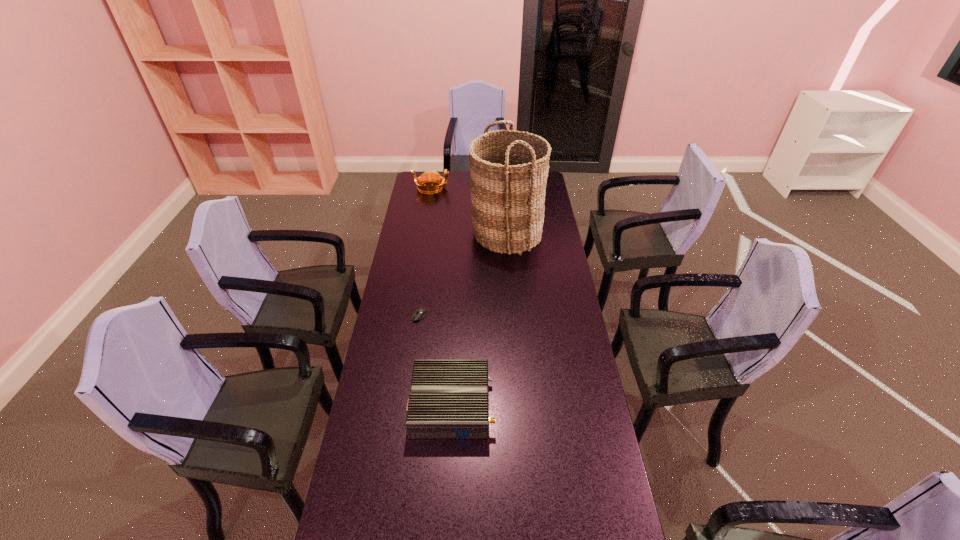
The height and width of the screenshot is (540, 960). Find the location of `basket`. basket is located at coordinates (509, 169).

This screenshot has width=960, height=540. In order to click on the tallest object in this screenshot , I will do `click(509, 169)`.

The height and width of the screenshot is (540, 960). What are the coordinates of `the farthest object` in the screenshot? It's located at (429, 176).

Where is `tiara`? tiara is located at coordinates (429, 176).

The image size is (960, 540). I want to click on the second shortest object, so click(x=449, y=399).

This screenshot has height=540, width=960. In order to click on the nearest object in this screenshot , I will do (449, 399).

The height and width of the screenshot is (540, 960). What are the coordinates of `the second nearest object` in the screenshot? It's located at (419, 313).

Where is `the shortest object`? This screenshot has width=960, height=540. the shortest object is located at coordinates (419, 313).

At what (x,y) coordinates should I click in order to perform the action: click on blank area located on the back of the second farthest object. Please return your answer as a coordinate pair (x, y). Image resolution: width=960 pixels, height=540 pixels. Looking at the image, I should click on (504, 205).

The height and width of the screenshot is (540, 960). Find the location of `vacant space located 0.260m at the front emblem of the tiara`. vacant space located 0.260m at the front emblem of the tiara is located at coordinates [495, 188].